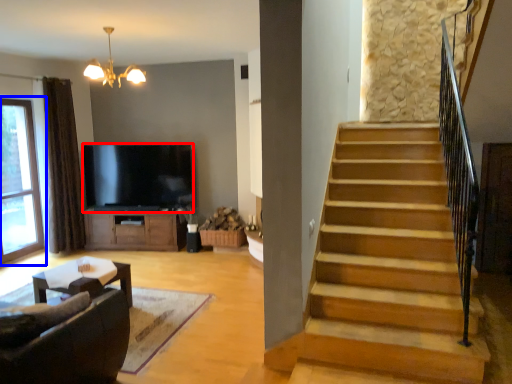
Question: Among these objects, which one is nearest to the camera, television (highlighted by a red box) or window (highlighted by a blue box)?

Choices:
 (A) television
 (B) window

Answer: (B)